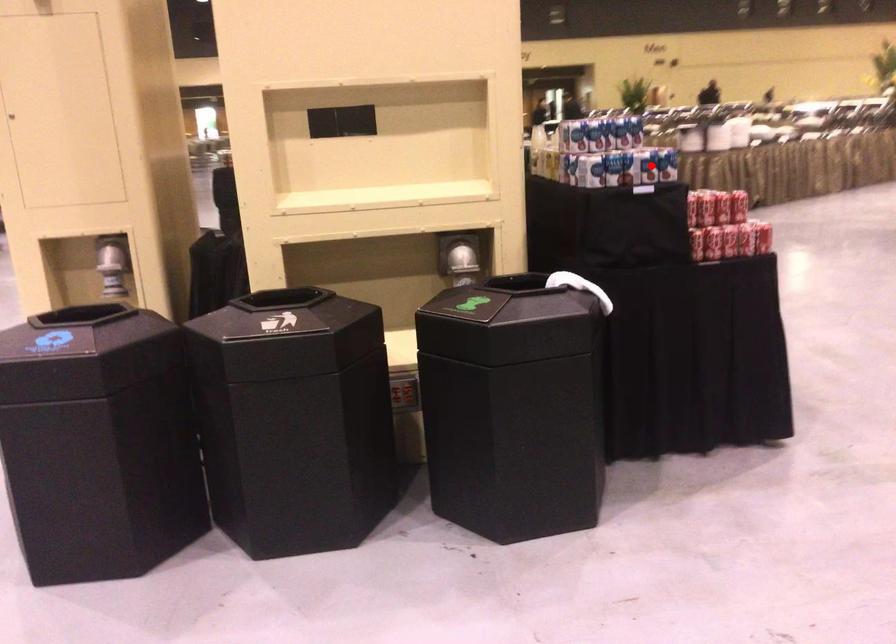
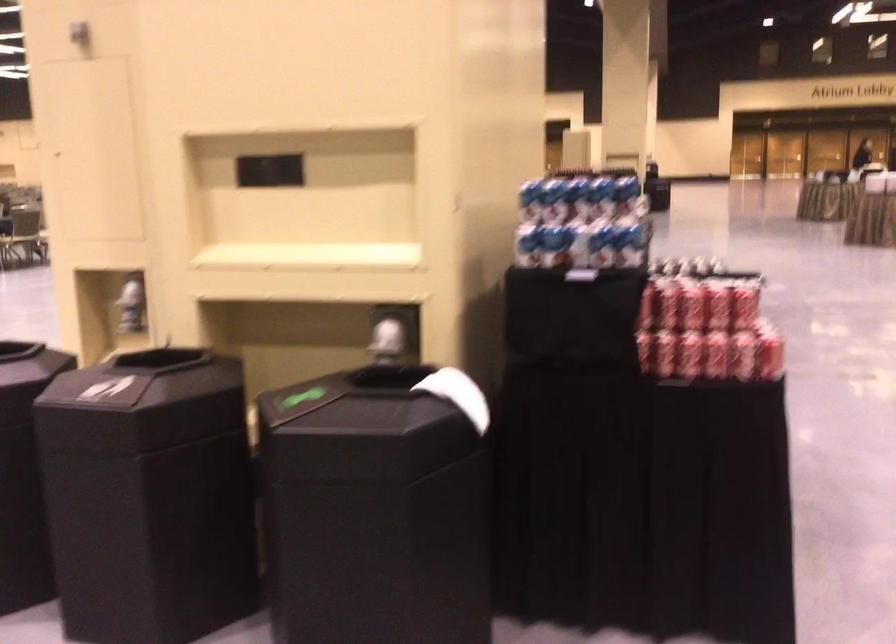
Question: I am providing you with two images of the same scene from different viewpoints. Image1 has a red point marked. In image2, the corresponding 3D location appears at what relative position? Reply with the corresponding letter.

Choices:
 (A) Closer
 (B) Farther

Answer: (A)